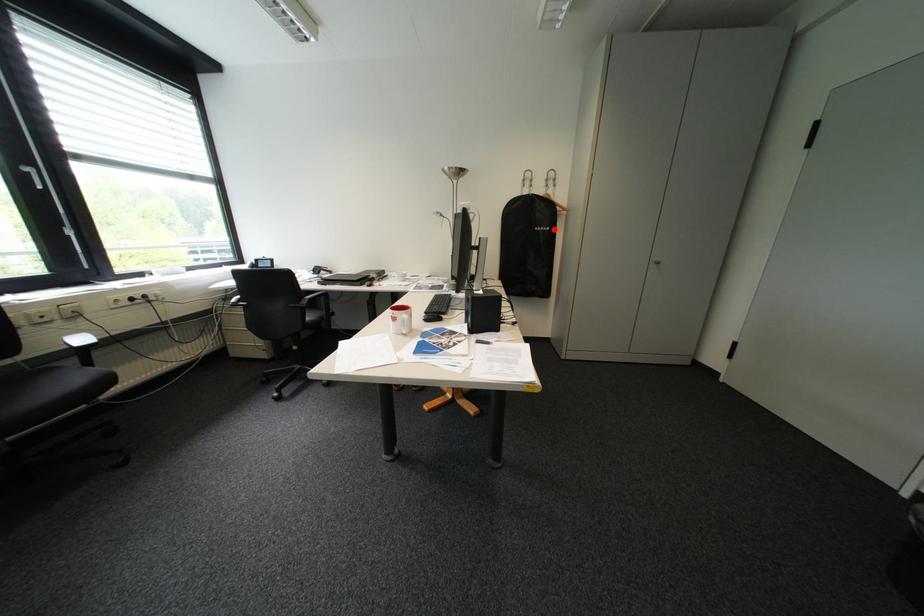
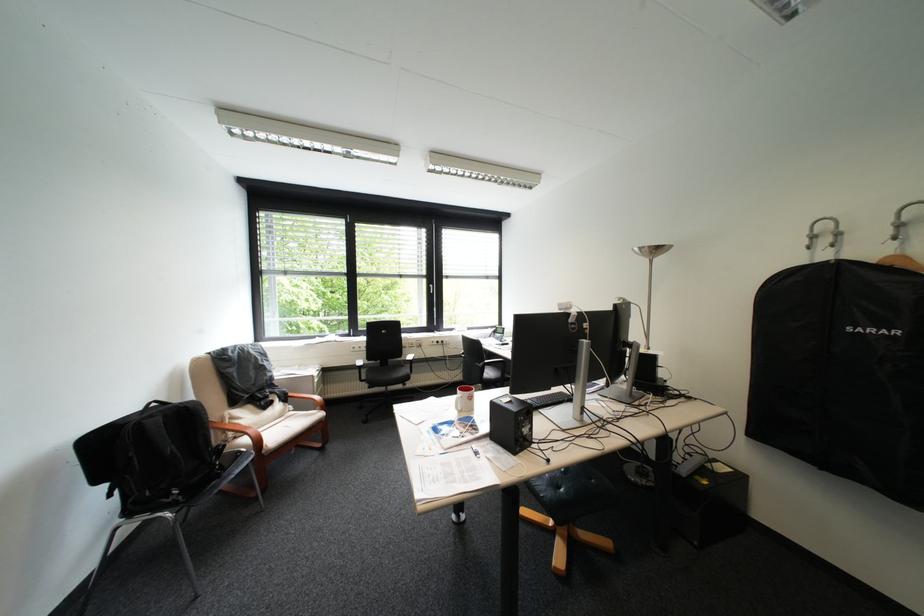
Find the pixel in the second image that matches the highlighted location in the first image.

(883, 331)